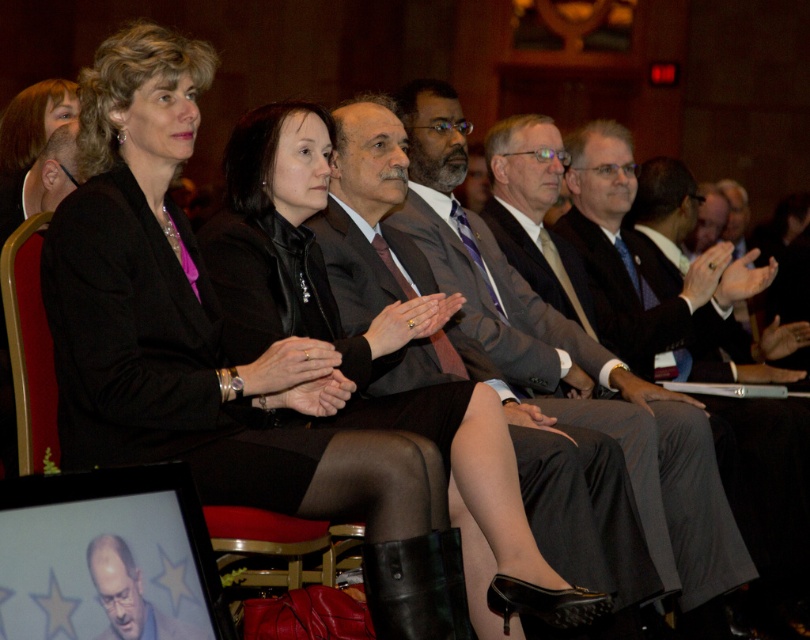
You are an event organizer and need to seat two guests, the matte black dress at center and the matte gray suit at center, at a table where space is limited. Which guest requires more seating space?

The matte gray suit at center requires more seating space because it has a larger size compared to the matte black dress at center.

You are an event planner arranging a photo shoot in the auditorium. You need to position two models wearing the matte black jacket at center and the matte black dress at center so that they are exactly 6.47 feet apart. Given that the auditorium has a stage 10 feet wide, can you place them on the stage without overlapping?

Yes, the matte black jacket at center and the matte black dress at center can be placed on the 10 feet wide stage without overlapping since they need to be 6.47 feet apart, which is less than the stage width. They can be positioned with 6.47 feet between them while leaving space on either side of the stage.

You are attending a professional event and need to locate two attendees wearing black attire. The first is wearing a matte black jacket at center, and the second is wearing a matte black dress at center. According to the scene, which of these two items is positioned to the left?

The matte black jacket at center is to the left of the matte black dress at center.